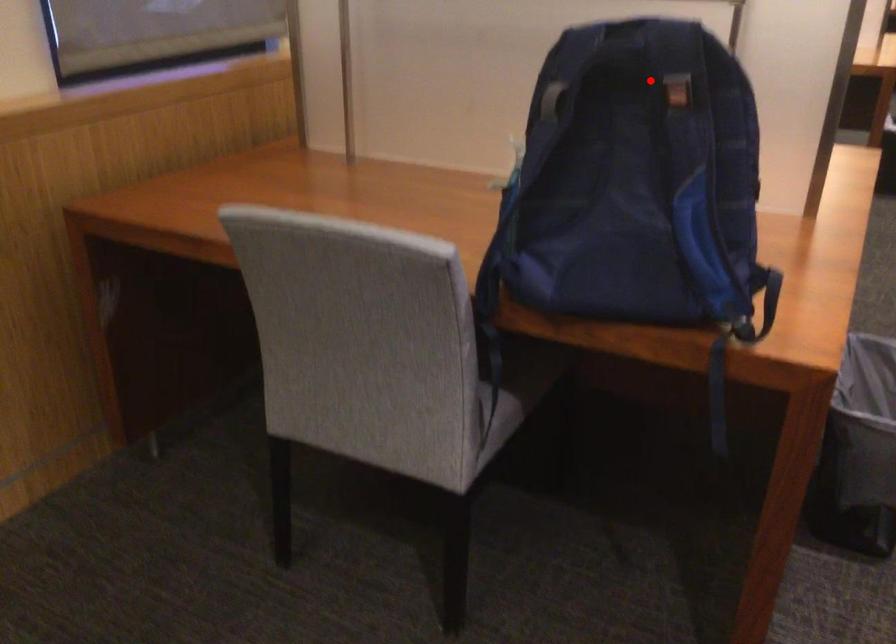
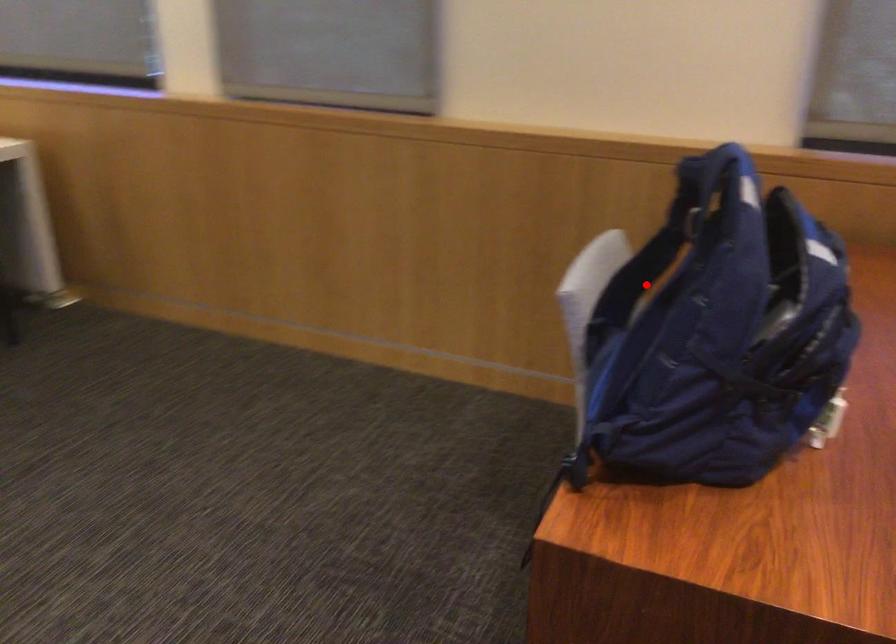
I am providing you with two images of the same scene from different viewpoints. A red point is marked on the first image and another point is marked on the second image. Is the marked point in image1 the same physical position as the marked point in image2?

No